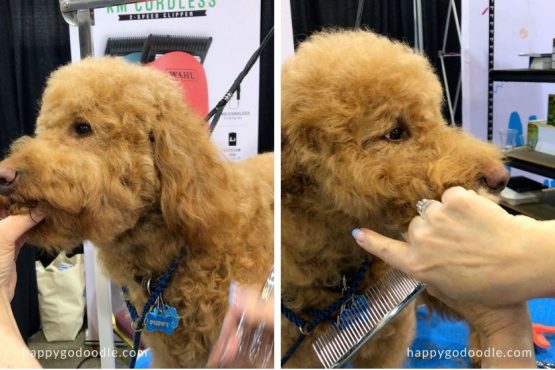
Identify the location of floor. The image size is (555, 370). (79, 340).